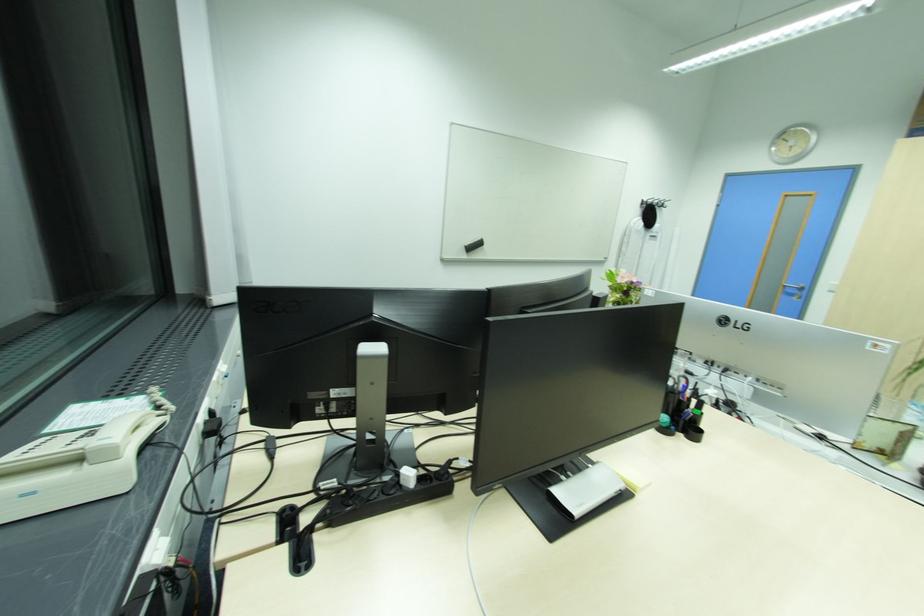
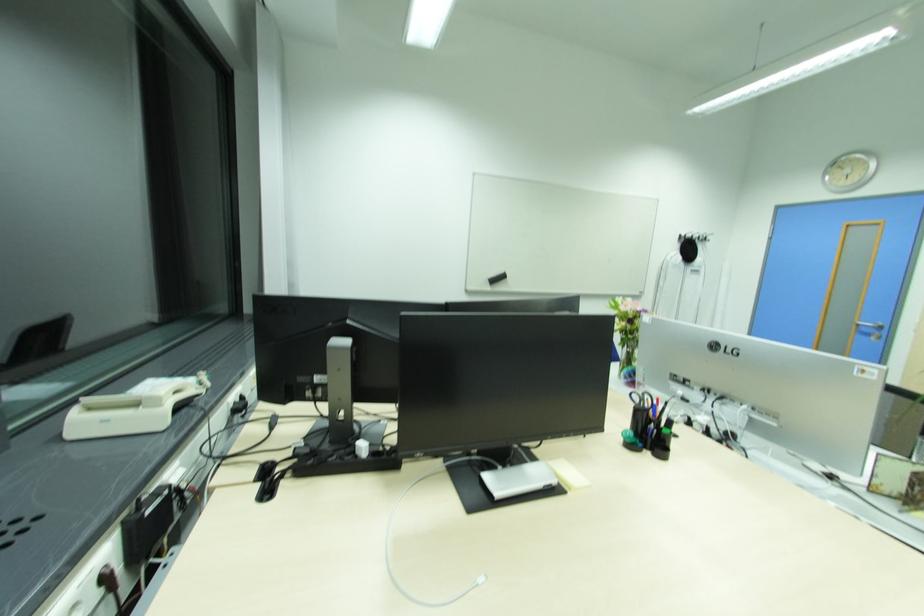
Question: The camera is either moving clockwise (left) or counter-clockwise (right) around the object. The first image is from the beginning of the video and the second image is from the end. Is the camera moving left or right when shooting the video?

Choices:
 (A) Left
 (B) Right

Answer: (B)